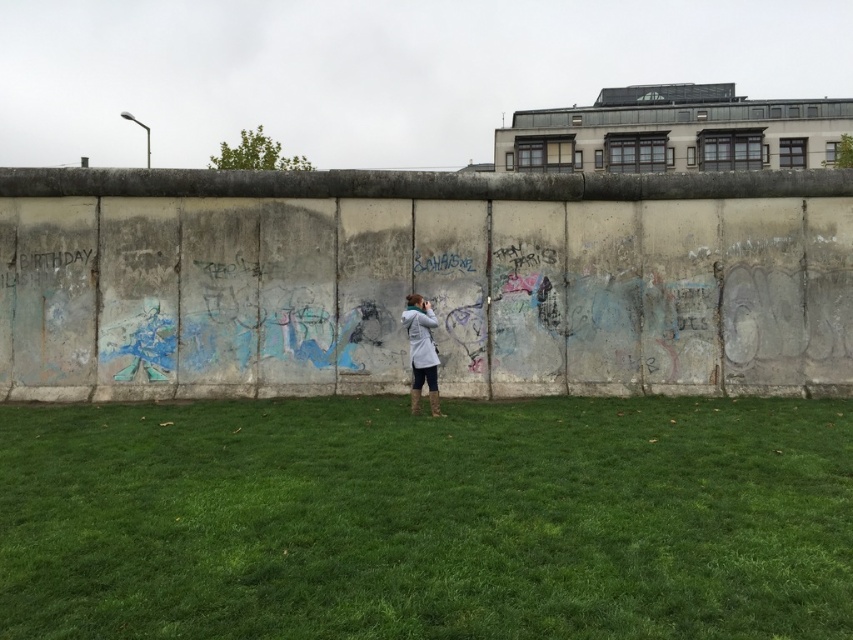
From the picture: Who is lower down, green grass at center or light gray fabric jacket at center?

green grass at center is below.

Identify the location of green grass at center. The width and height of the screenshot is (853, 640). (427, 518).

This screenshot has height=640, width=853. What do you see at coordinates (427, 518) in the screenshot?
I see `green grass at center` at bounding box center [427, 518].

Identify the location of green grass at center. (427, 518).